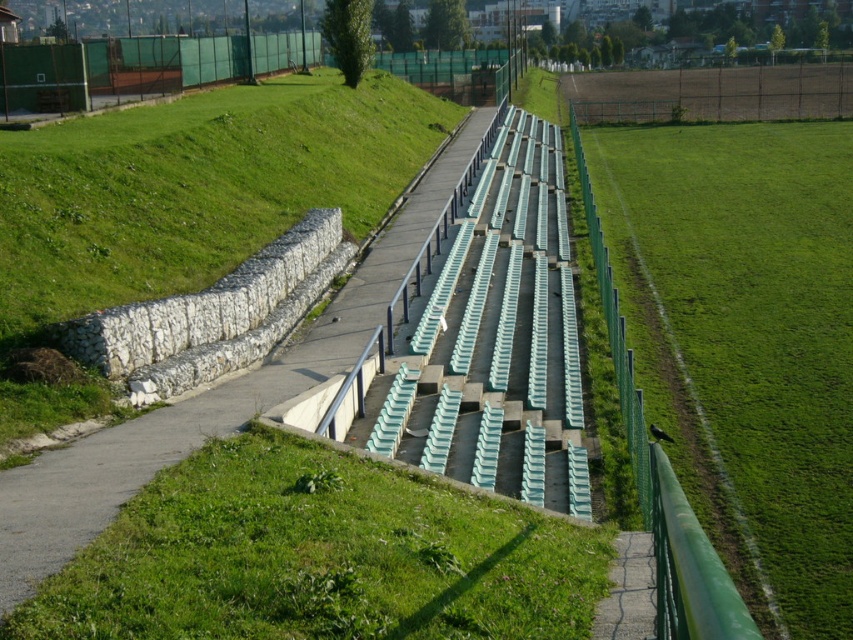
You are planning to install a new bench in the outdoor seating area. The bench requires a space that is at least as large as the green grass at right. Can the concrete path at center accommodate the bench?

The green grass at right is larger in size than the concrete path at center, so the concrete path at center cannot accommodate the bench since it is smaller than the required space.

You are a groundskeeper checking the lawn conditions. You notice two areas of green grass at right and green grassy at center. Which area has taller grass?

The green grass at right is taller than the green grassy at center.